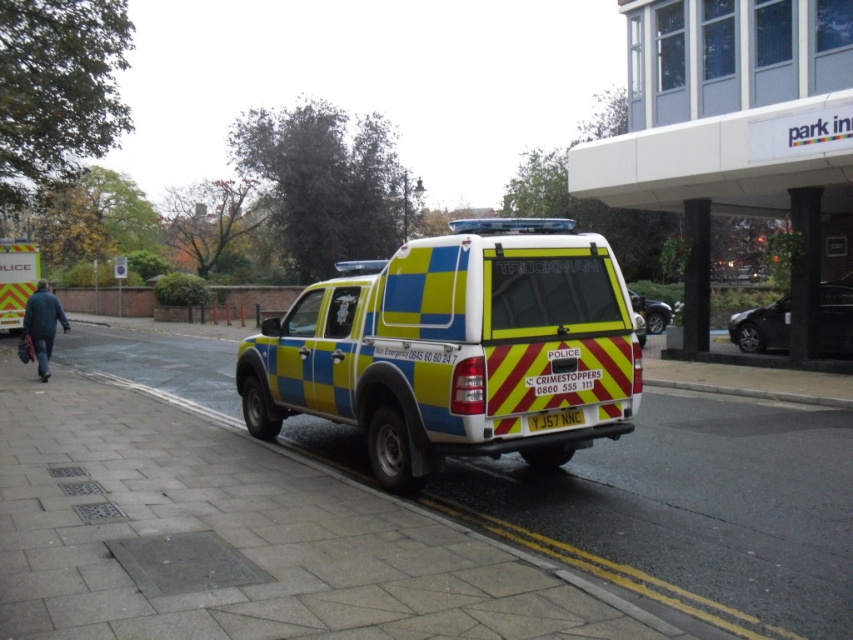
Question: Which of these objects is positioned closest to the paved concrete sidewalk at center?

Choices:
 (A) metallic silver car at right
 (B) yellow reflective van at center

Answer: (B)

Question: In this image, where is yellow and blue checkered truck at center located relative to metallic silver car at right?

Choices:
 (A) right
 (B) left

Answer: (B)

Question: Does yellow and blue checkered truck at center appear over yellow reflective plate at center?

Choices:
 (A) yes
 (B) no

Answer: (A)

Question: Which object is the farthest from the paved concrete sidewalk at center?

Choices:
 (A) yellow reflective plate at center
 (B) metallic silver car at right

Answer: (B)

Question: Which object is closer to the camera taking this photo?

Choices:
 (A) metallic silver car at right
 (B) yellow reflective plate at center

Answer: (B)

Question: Is paved concrete sidewalk at center smaller than yellow reflective van at center?

Choices:
 (A) yes
 (B) no

Answer: (A)